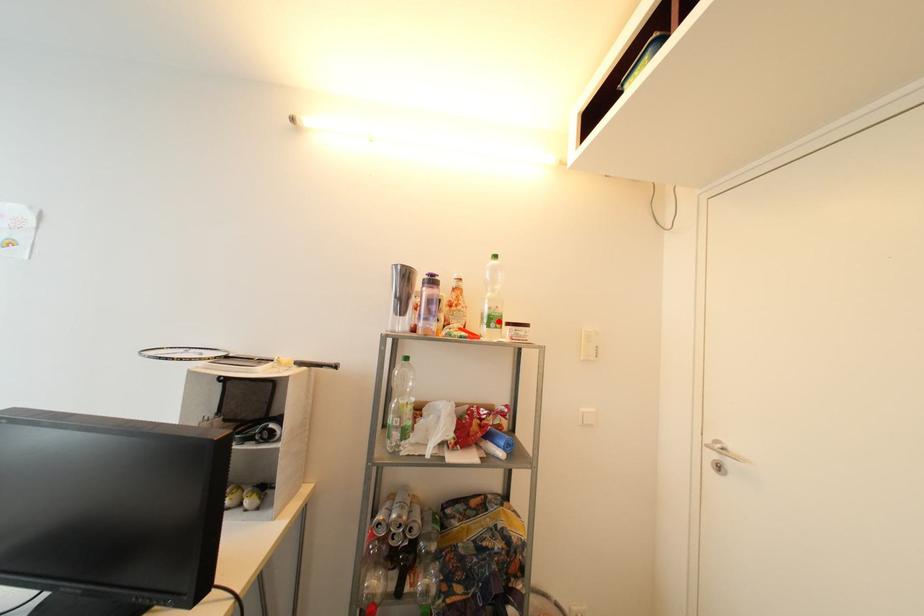
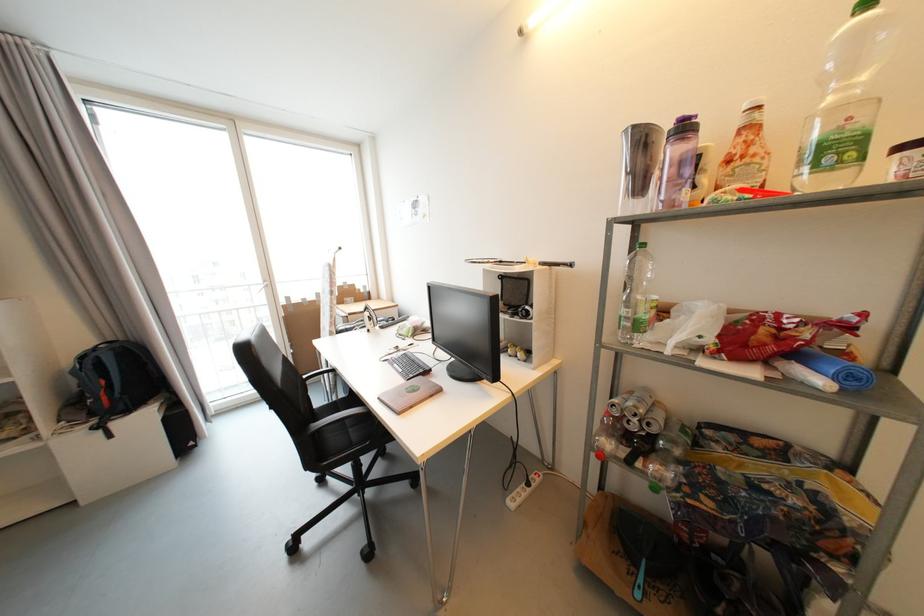
Question: I am providing you with two images of the same scene from different viewpoints. A red point is marked on the first image. At the location where the point appears in image 1, is it still visible in image 2?

Choices:
 (A) Yes
 (B) No

Answer: (A)